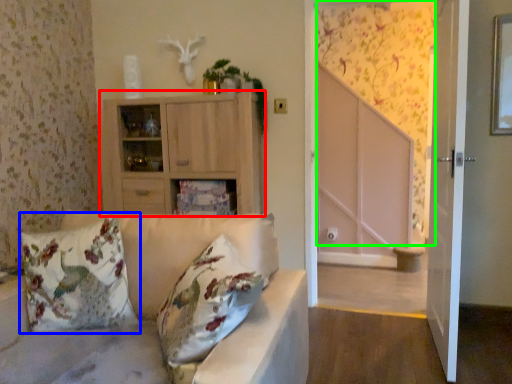
Question: Estimate the real-world distances between objects in this image. Which object is closer to cabinetry (highlighted by a red box), pillow (highlighted by a blue box) or curtain (highlighted by a green box)?

Choices:
 (A) pillow
 (B) curtain

Answer: (A)